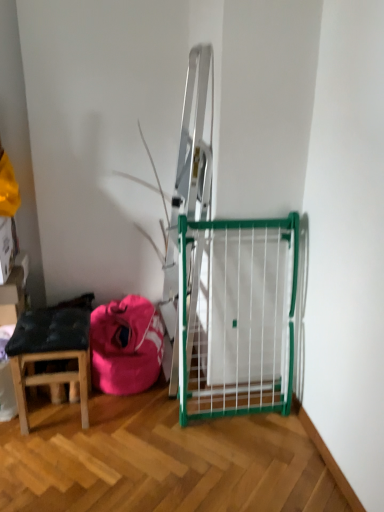
You are a GUI agent. You are given a task and a screenshot of the screen. Output one action in this format:
    pyautogui.click(x=<x>, y=<y>)
    Task: Click on the pink fabric bean bag at lower left
    This screenshot has width=384, height=512.
    Given the screenshot: What is the action you would take?
    pyautogui.click(x=125, y=345)

What do you see at coordinates (125, 345) in the screenshot?
I see `pink fabric bean bag at lower left` at bounding box center [125, 345].

What do you see at coordinates (50, 353) in the screenshot? Image resolution: width=384 pixels, height=512 pixels. I see `wooden stool at lower left` at bounding box center [50, 353].

Where is `wooden stool at lower left`? The image size is (384, 512). wooden stool at lower left is located at coordinates (50, 353).

This screenshot has width=384, height=512. Identify the location of pink fabric bean bag at lower left. (125, 345).

From the picture: Is wooden stool at lower left at the left side of pink fabric bean bag at lower left?

Yes, wooden stool at lower left is to the left of pink fabric bean bag at lower left.

From the picture: Is the position of wooden stool at lower left less distant than that of pink fabric bean bag at lower left?

Yes.

Which point is more forward, (36, 335) or (150, 321)?

The point (36, 335) is closer.

From the image's perspective, is wooden stool at lower left below pink fabric bean bag at lower left?

Indeed, from the image's perspective, wooden stool at lower left is shown beneath pink fabric bean bag at lower left.

From a real-world perspective, who is located higher, wooden stool at lower left or pink fabric bean bag at lower left?

→ wooden stool at lower left, from a real-world perspective.

Considering the sizes of wooden stool at lower left and pink fabric bean bag at lower left in the image, is wooden stool at lower left wider or thinner than pink fabric bean bag at lower left?

Considering their sizes, wooden stool at lower left looks slimmer than pink fabric bean bag at lower left.

Is wooden stool at lower left shorter than pink fabric bean bag at lower left?

No.

In terms of size, does wooden stool at lower left appear bigger or smaller than pink fabric bean bag at lower left?

wooden stool at lower left is smaller than pink fabric bean bag at lower left.

Do you think wooden stool at lower left is within pink fabric bean bag at lower left, or outside of it?

wooden stool at lower left exists outside the volume of pink fabric bean bag at lower left.

Is wooden stool at lower left not near pink fabric bean bag at lower left?

wooden stool at lower left is near pink fabric bean bag at lower left, not far away.

Is wooden stool at lower left oriented away from pink fabric bean bag at lower left?

No, wooden stool at lower left is not facing away from pink fabric bean bag at lower left.

I want to click on bean bag chair above the wooden stool at lower left (from the image's perspective), so click(x=125, y=345).

Considering the relative positions of pink fabric bean bag at lower left and wooden stool at lower left in the image provided, is pink fabric bean bag at lower left to the left of wooden stool at lower left from the viewer's perspective?

Incorrect, pink fabric bean bag at lower left is not on the left side of wooden stool at lower left.

Which object is more forward, pink fabric bean bag at lower left or wooden stool at lower left?

Positioned in front is wooden stool at lower left.

Does point (160, 359) appear closer or farther from the camera than point (30, 312)?

Point (160, 359) is positioned closer to the camera compared to point (30, 312).

From the image's perspective, does pink fabric bean bag at lower left appear higher than wooden stool at lower left?

Yes.

From a real-world perspective, is pink fabric bean bag at lower left physically located above or below wooden stool at lower left?

In terms of real-world spatial position, pink fabric bean bag at lower left is below wooden stool at lower left.

Does pink fabric bean bag at lower left have a lesser width compared to wooden stool at lower left?

Incorrect, the width of pink fabric bean bag at lower left is not less than that of wooden stool at lower left.

Who is taller, pink fabric bean bag at lower left or wooden stool at lower left?

Standing taller between the two is wooden stool at lower left.

Between pink fabric bean bag at lower left and wooden stool at lower left, which one has larger size?

pink fabric bean bag at lower left is bigger.

Would you say wooden stool at lower left is part of pink fabric bean bag at lower left's contents?

No, wooden stool at lower left is located outside of pink fabric bean bag at lower left.

Would you consider pink fabric bean bag at lower left to be distant from wooden stool at lower left?

Actually, pink fabric bean bag at lower left and wooden stool at lower left are a little close together.

Is pink fabric bean bag at lower left aimed at wooden stool at lower left?

No, pink fabric bean bag at lower left is not oriented towards wooden stool at lower left.

How distant is pink fabric bean bag at lower left from wooden stool at lower left?

pink fabric bean bag at lower left is 8.50 inches away from wooden stool at lower left.

Locate an element on the screen. This screenshot has height=512, width=384. bean bag chair behind the wooden stool at lower left is located at coordinates (125, 345).

Locate an element on the screen. stool that appears on the left of pink fabric bean bag at lower left is located at coordinates (50, 353).

At what (x,y) coordinates should I click in order to perform the action: click on stool below the pink fabric bean bag at lower left (from the image's perspective). Please return your answer as a coordinate pair (x, y). The height and width of the screenshot is (512, 384). Looking at the image, I should click on (50, 353).